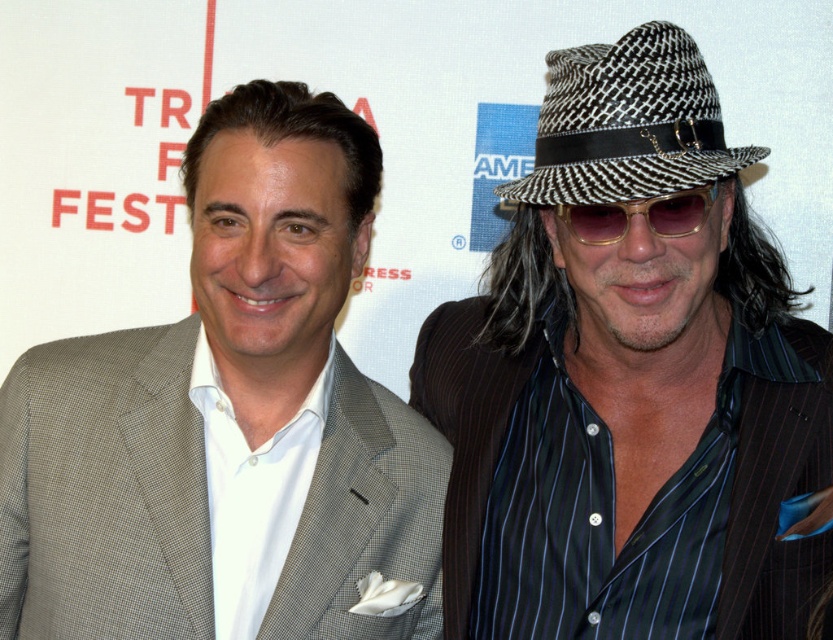
Does matte gray suit at left appear on the right side of gold metallic sunglasses at right?

In fact, matte gray suit at left is to the left of gold metallic sunglasses at right.

Is matte gray suit at left shorter than gold metallic sunglasses at right?

In fact, matte gray suit at left may be taller than gold metallic sunglasses at right.

Does point (247, 369) come behind point (681, 189)?

That is True.

Locate an element on the screen. The image size is (833, 640). matte gray suit at left is located at coordinates (x=228, y=420).

From the picture: Is black and white checkered hat at center to the left of matte gray suit at left from the viewer's perspective?

No, black and white checkered hat at center is not to the left of matte gray suit at left.

Who is higher up, black and white checkered hat at center or matte gray suit at left?

Positioned higher is black and white checkered hat at center.

I want to click on black and white checkered hat at center, so click(x=631, y=385).

Does black and white checkered hat at center come in front of black and white woven fedora at upper right?

No, black and white checkered hat at center is behind black and white woven fedora at upper right.

Is black and white checkered hat at center to the right of black and white woven fedora at upper right from the viewer's perspective?

Indeed, black and white checkered hat at center is positioned on the right side of black and white woven fedora at upper right.

The image size is (833, 640). What are the coordinates of `black and white checkered hat at center` in the screenshot? It's located at (631, 385).